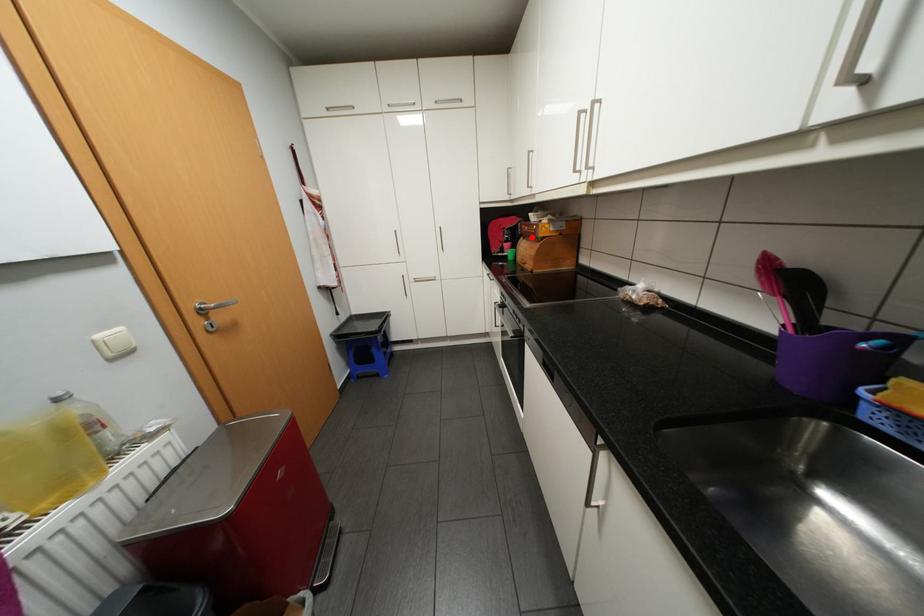
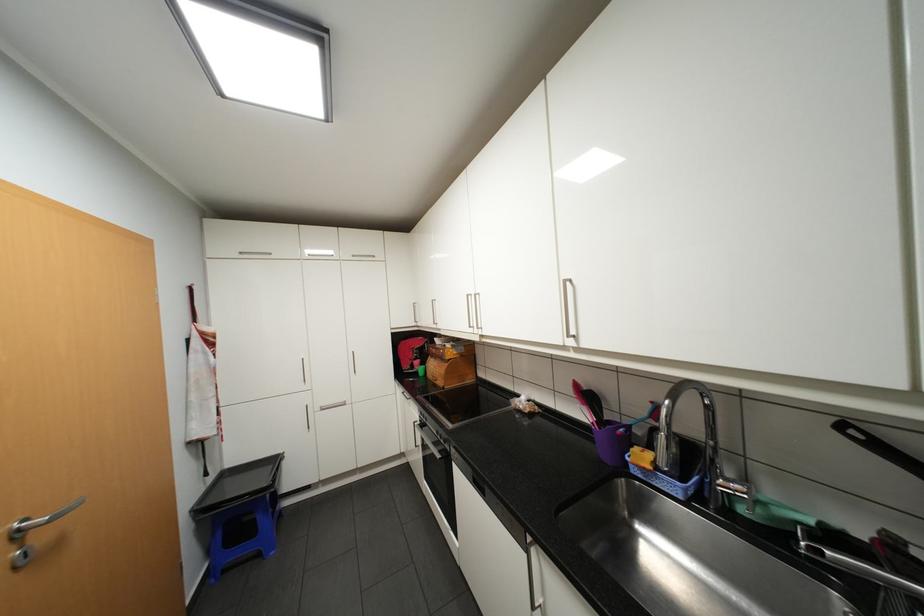
Question: I am providing you with two images of the same scene from different viewpoints. Given a red point in image1, look at the same physical point in image2. Is it:

Choices:
 (A) Closer to the viewpoint
 (B) Farther from the viewpoint

Answer: (B)